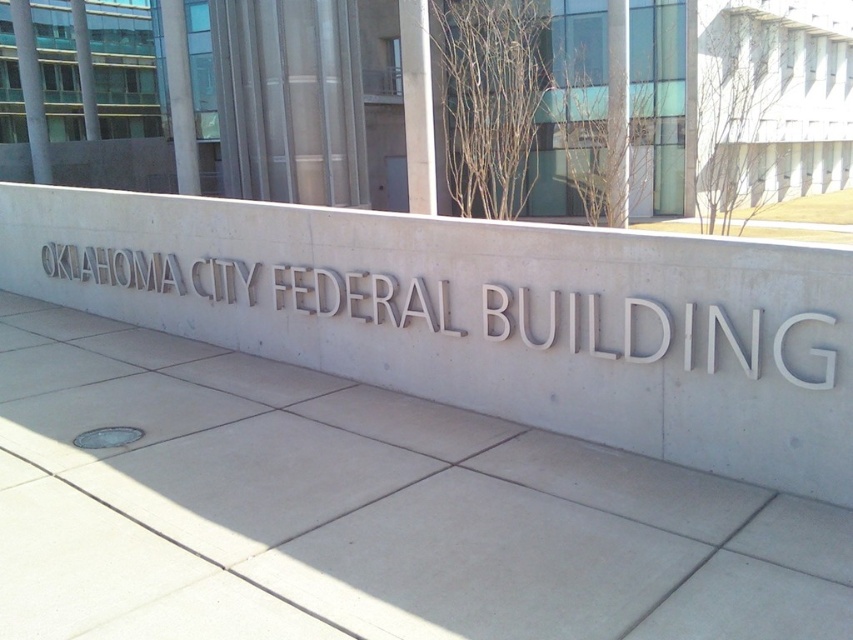
You are standing at the entrance of the Oklahoma City Federal Building and notice two points marked on the wall. The first point is at coordinate point (544, 369) and the second is at point (392, 300). Which point appears closer to you?

Point (544, 369) is closer to the camera than point (392, 300), so the first point appears closer to you.

Consider the image. You are a delivery driver who needs to park your truck near the Oklahoma City Federal Building. You notice the gray concrete pavement at center and the gray metallic sign at center. Which one is shorter in height?

The gray concrete pavement at center is not as tall as the gray metallic sign at center, so the gray concrete pavement at center is shorter in height.